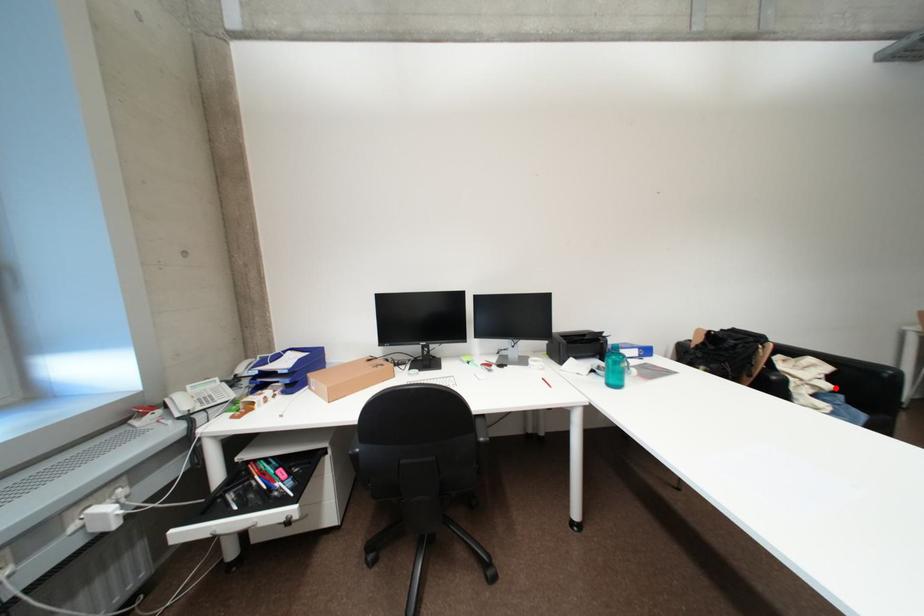
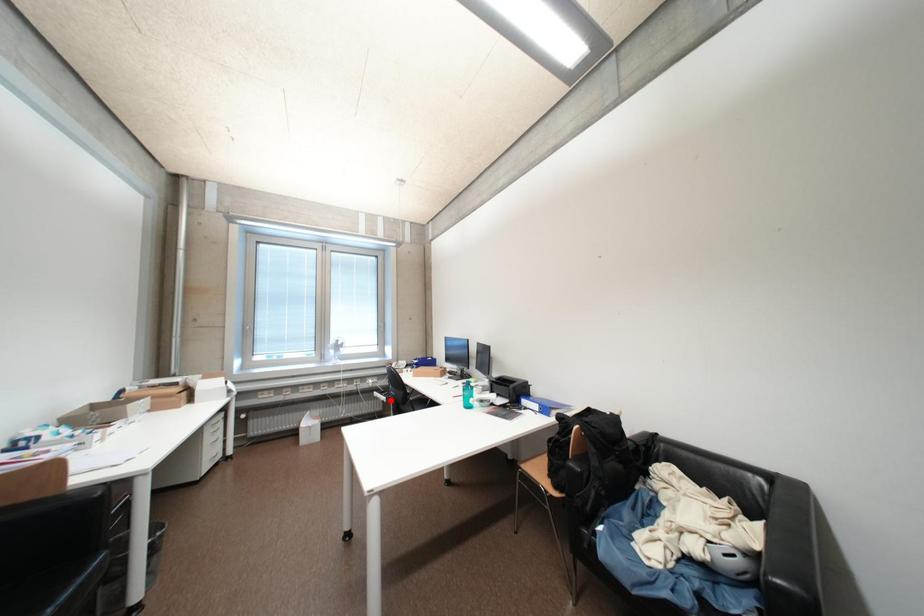
I am providing you with two images of the same scene from different viewpoints. A red point is marked on the first image and another point is marked on the second image. Is the marked point in image1 the same physical position as the marked point in image2?

No